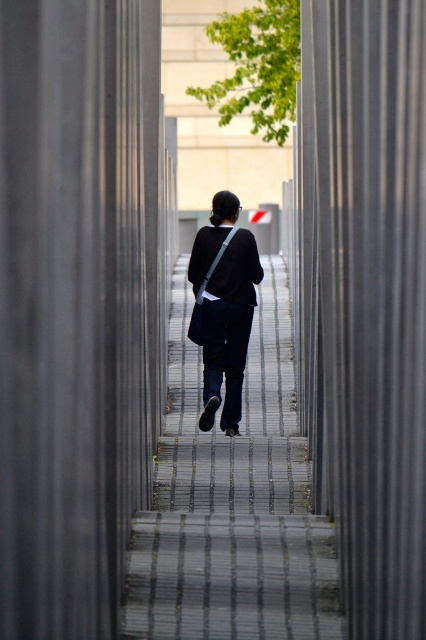
Between dark blue jeans at center and matte black jacket at center, which one has less height?

With less height is dark blue jeans at center.

Image resolution: width=426 pixels, height=640 pixels. In order to click on dark blue jeans at center in this screenshot , I will do `click(233, 502)`.

The image size is (426, 640). In order to click on dark blue jeans at center in this screenshot , I will do `click(233, 502)`.